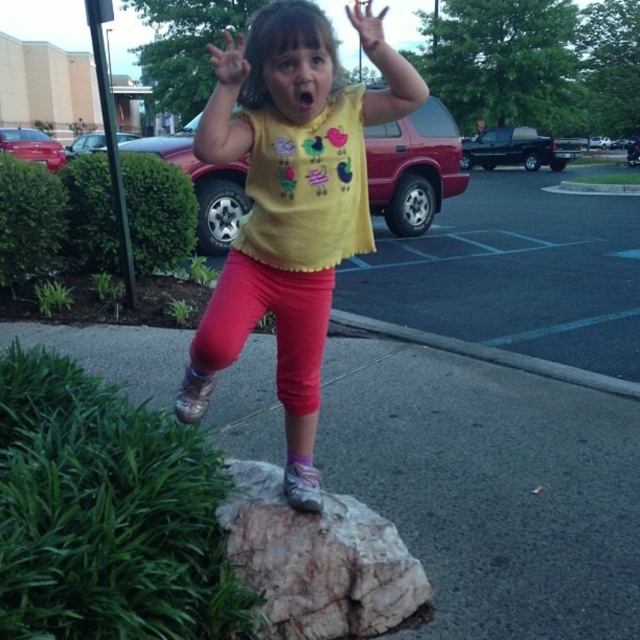
Is gray asphalt pavement at center smaller than matte yellow shirt at center?

No, gray asphalt pavement at center is not smaller than matte yellow shirt at center.

The width and height of the screenshot is (640, 640). I want to click on gray asphalt pavement at center, so click(x=492, y=486).

The height and width of the screenshot is (640, 640). Find the location of `gray asphalt pavement at center`. gray asphalt pavement at center is located at coordinates (492, 486).